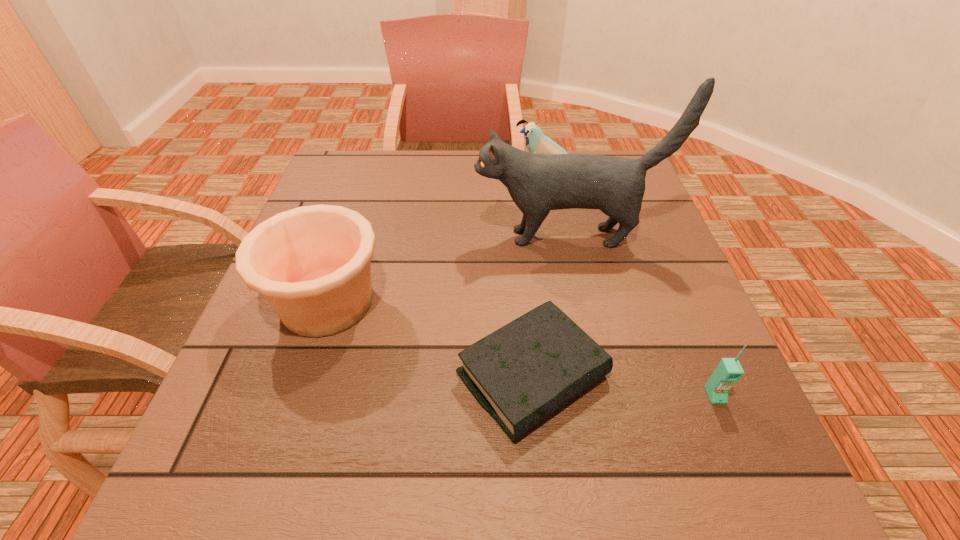
Find the location of a particular element. This screenshot has width=960, height=540. free region located 0.130m at the face of the bird is located at coordinates (468, 173).

Find the location of a particular element. The image size is (960, 540). vacant position located at the face of the bird is located at coordinates (468, 173).

The width and height of the screenshot is (960, 540). In order to click on free space located 0.090m on the front of the leftmost object in this screenshot , I will do `click(297, 394)`.

I want to click on vacant space located on the keypad of the fourth tallest object, so click(741, 457).

This screenshot has width=960, height=540. Identify the location of free space located 0.050m on the left of the Bible. (428, 376).

Image resolution: width=960 pixels, height=540 pixels. Find the location of `object that is at the far edge`. object that is at the far edge is located at coordinates (536, 142).

At what (x,y) coordinates should I click in order to perform the action: click on object located in the left edge section of the desktop. Please return your answer as a coordinate pair (x, y). This screenshot has height=540, width=960. Looking at the image, I should click on (312, 264).

Where is `cat that is at the right edge`? The width and height of the screenshot is (960, 540). cat that is at the right edge is located at coordinates (537, 183).

This screenshot has height=540, width=960. I want to click on bird located in the right edge section of the desktop, so click(x=536, y=142).

Image resolution: width=960 pixels, height=540 pixels. I want to click on cellular telephone that is at the right edge, so click(729, 370).